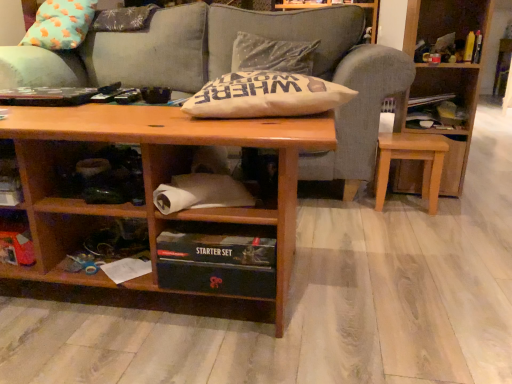
Question: Can you confirm if wooden box at lower left is thinner than black cardboard box at lower center, arranged as the 1th cabinet when ordered from the bottom?

Choices:
 (A) no
 (B) yes

Answer: (B)

Question: From a real-world perspective, is wooden box at lower left over black cardboard box at lower center, arranged as the 2th cabinet when viewed from the top?

Choices:
 (A) yes
 (B) no

Answer: (B)

Question: Can you confirm if wooden box at lower left is shorter than black cardboard box at lower center, arranged as the 2th cabinet when viewed from the top?

Choices:
 (A) yes
 (B) no

Answer: (A)

Question: Does wooden box at lower left have a greater width compared to black cardboard box at lower center, arranged as the 1th cabinet when ordered from the bottom?

Choices:
 (A) yes
 (B) no

Answer: (B)

Question: Could black cardboard box at lower center, arranged as the 2th cabinet when viewed from the top, be considered to be inside wooden box at lower left?

Choices:
 (A) yes
 (B) no

Answer: (B)

Question: Is wooden bookcase at right bigger or smaller than gray fabric couch at center?

Choices:
 (A) big
 (B) small

Answer: (B)

Question: From a real-world perspective, is wooden bookcase at right above or below gray fabric couch at center?

Choices:
 (A) above
 (B) below

Answer: (B)

Question: From the image's perspective, is wooden bookcase at right positioned above or below gray fabric couch at center?

Choices:
 (A) below
 (B) above

Answer: (A)

Question: Does point (401, 173) appear closer or farther from the camera than point (356, 130)?

Choices:
 (A) closer
 (B) farther

Answer: (B)

Question: Is light brown wooden stool at lower right wider or thinner than wooden bookcase at right?

Choices:
 (A) thin
 (B) wide

Answer: (A)

Question: Considering the relative positions of light brown wooden stool at lower right and wooden bookcase at right in the image provided, is light brown wooden stool at lower right to the left or to the right of wooden bookcase at right?

Choices:
 (A) left
 (B) right

Answer: (A)

Question: Considering the positions of light brown wooden stool at lower right and wooden bookcase at right in the image, is light brown wooden stool at lower right taller or shorter than wooden bookcase at right?

Choices:
 (A) short
 (B) tall

Answer: (A)

Question: Considering the positions of point (407, 158) and point (403, 49), is point (407, 158) closer or farther from the camera than point (403, 49)?

Choices:
 (A) farther
 (B) closer

Answer: (B)

Question: Considering their positions, is matte cardboard paper at lower center, the 1th cabinet from the top, located in front of or behind light brown wooden stool at lower right?

Choices:
 (A) front
 (B) behind

Answer: (A)

Question: Is matte cardboard paper at lower center, the 1th cabinet from the top, inside or outside of light brown wooden stool at lower right?

Choices:
 (A) outside
 (B) inside

Answer: (A)